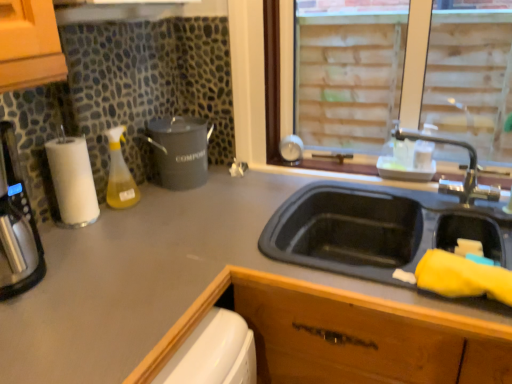
Locate an element on the screen. free space to the back side of brass metallic faucet at upper right is located at coordinates coord(390,182).